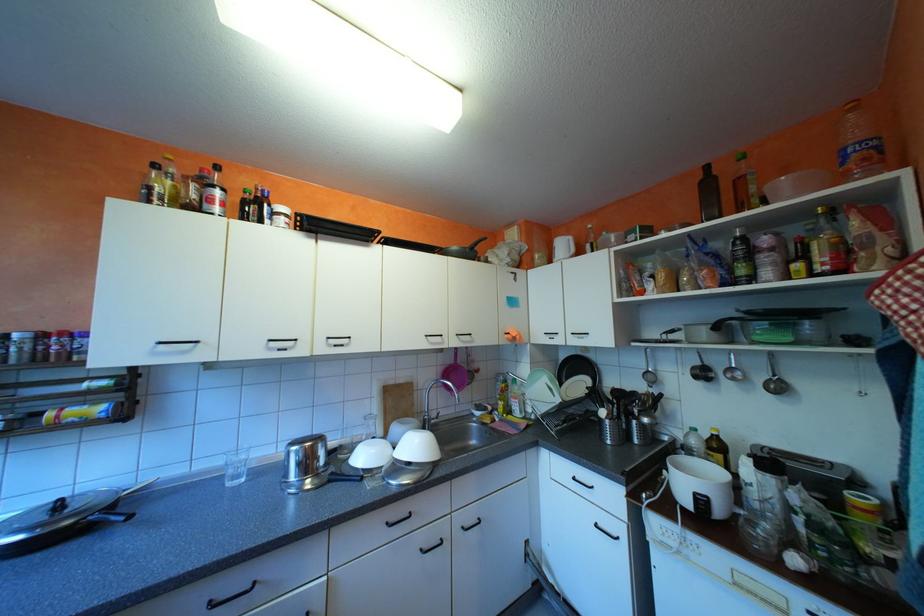
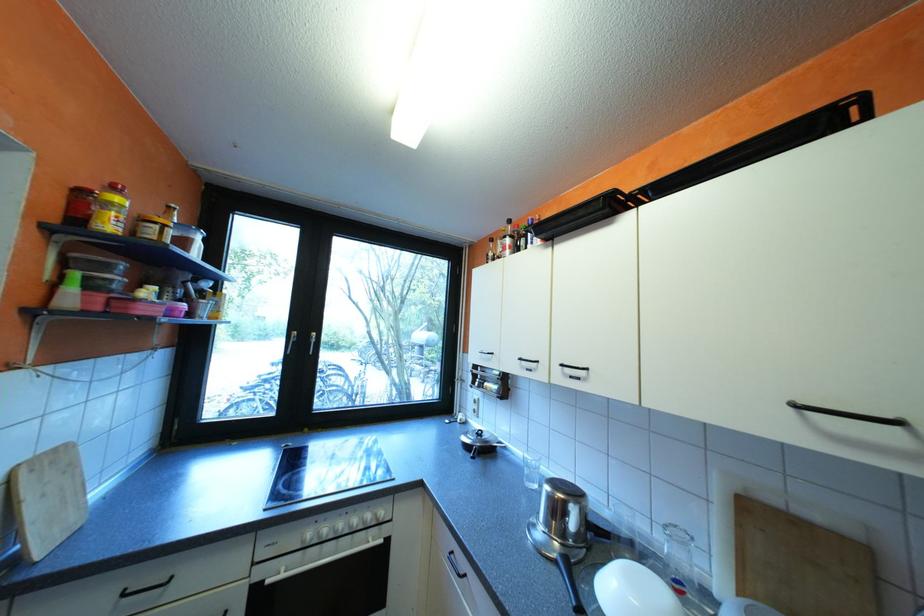
Where in the second image is the point corresponding to (341,344) from the first image?

(576, 373)